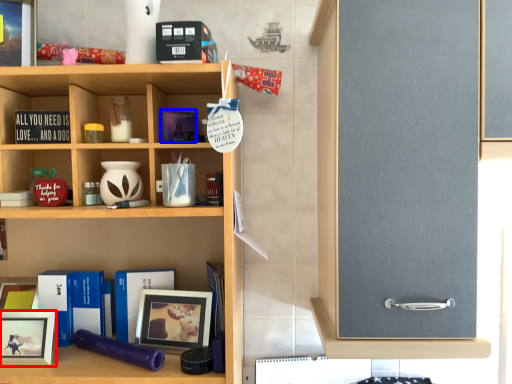
Question: Which object appears farthest to the camera in this image, picture frame (highlighted by a red box) or book (highlighted by a blue box)?

Choices:
 (A) picture frame
 (B) book

Answer: (B)